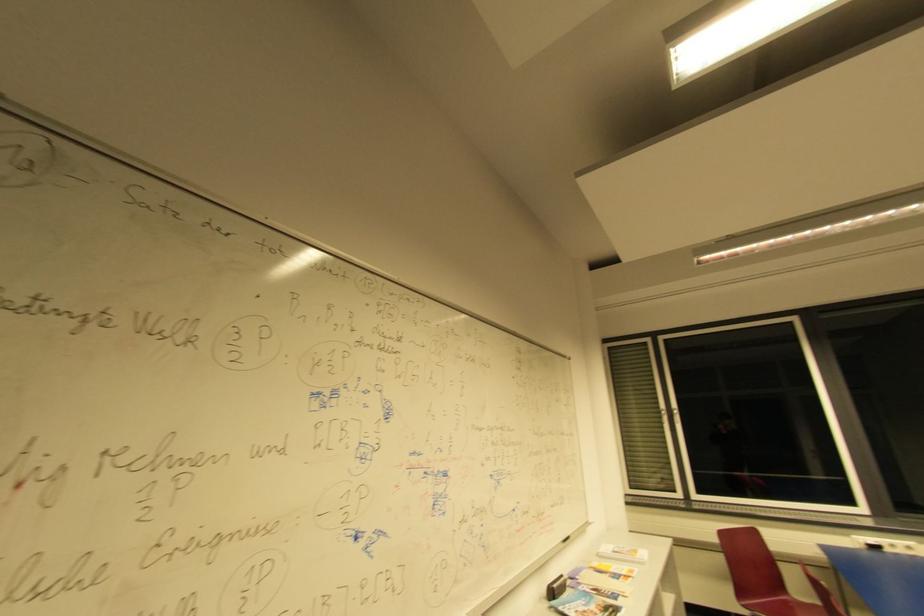
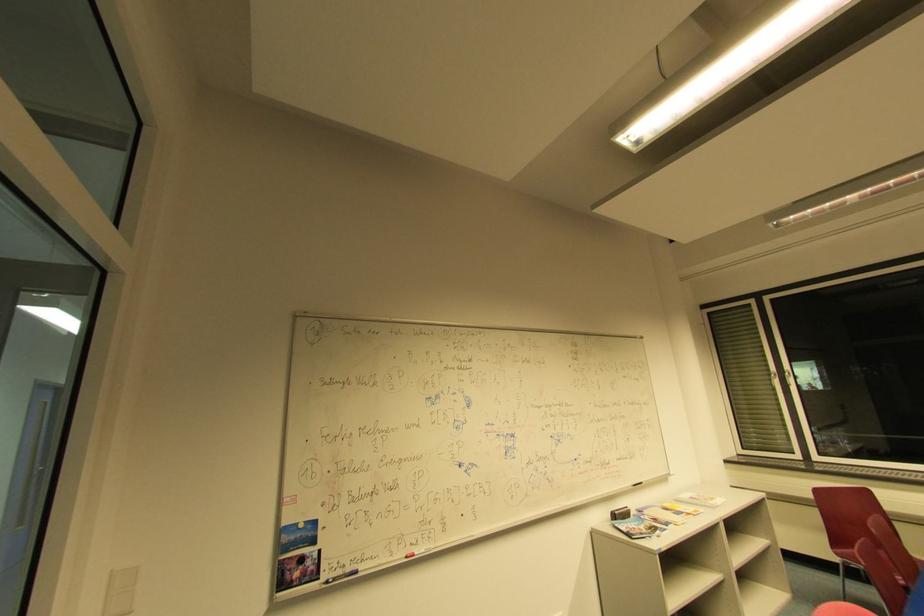
In the second image, find the point that corresponds to point 618,580 in the first image.

(679, 515)